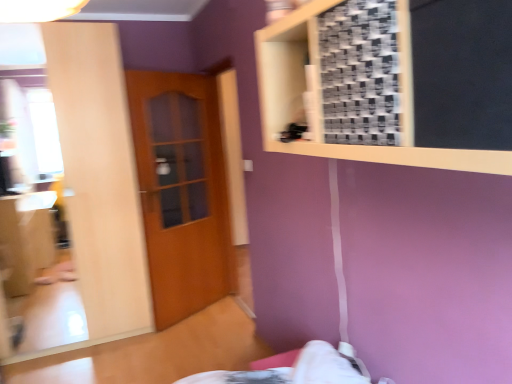
Question: Can you see matte wooden mirror at left touching wooden door at center?

Choices:
 (A) yes
 (B) no

Answer: (B)

Question: Is matte wooden mirror at left to the left of wooden door at center from the viewer's perspective?

Choices:
 (A) yes
 (B) no

Answer: (A)

Question: Is matte wooden mirror at left thinner than wooden door at center?

Choices:
 (A) yes
 (B) no

Answer: (B)

Question: Is matte wooden mirror at left facing away from wooden door at center?

Choices:
 (A) yes
 (B) no

Answer: (B)

Question: From the image's perspective, is matte wooden mirror at left beneath wooden door at center?

Choices:
 (A) no
 (B) yes

Answer: (A)

Question: Could wooden door at center be considered to be inside matte wooden mirror at left?

Choices:
 (A) yes
 (B) no

Answer: (B)

Question: Is matte wooden mirror at left located outside wooden frame at upper right?

Choices:
 (A) no
 (B) yes

Answer: (B)

Question: Is matte wooden mirror at left wider than wooden frame at upper right?

Choices:
 (A) no
 (B) yes

Answer: (B)

Question: Considering the relative positions of matte wooden mirror at left and wooden frame at upper right in the image provided, is matte wooden mirror at left in front of wooden frame at upper right?

Choices:
 (A) no
 (B) yes

Answer: (A)

Question: Is matte wooden mirror at left next to wooden frame at upper right and touching it?

Choices:
 (A) no
 (B) yes

Answer: (A)

Question: Does matte wooden mirror at left have a smaller size compared to wooden frame at upper right?

Choices:
 (A) yes
 (B) no

Answer: (B)

Question: Could wooden frame at upper right be considered to be inside matte wooden mirror at left?

Choices:
 (A) yes
 (B) no

Answer: (B)

Question: Is wooden door at center positioned before wooden frame at upper right?

Choices:
 (A) no
 (B) yes

Answer: (A)